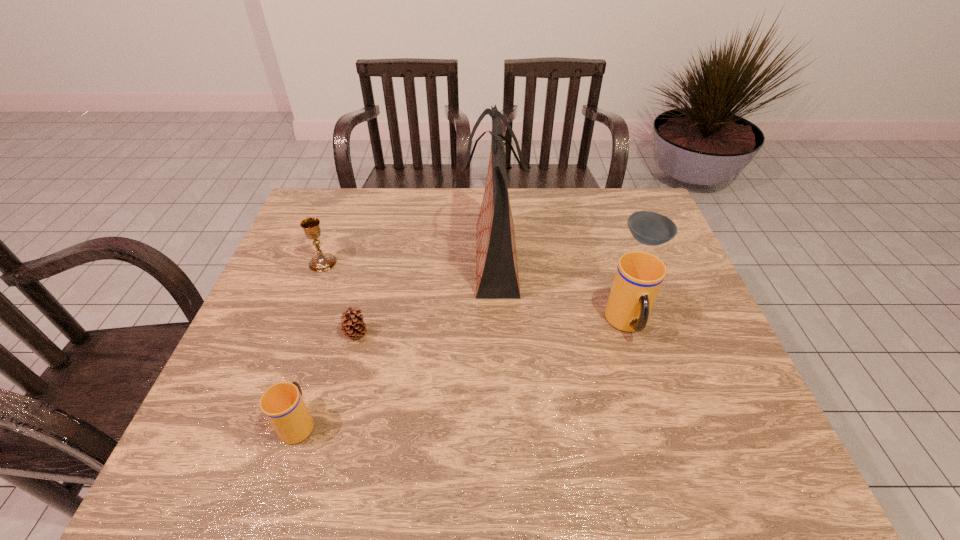
What are the coordinates of `free space at the near edge` in the screenshot? It's located at (585, 408).

The width and height of the screenshot is (960, 540). In the image, there is a desktop. Identify the location of free space at the left edge. (258, 346).

In the image, there is a desktop. Identify the location of vacant space at the far right corner. The image size is (960, 540). (607, 188).

The height and width of the screenshot is (540, 960). Find the location of `vacant space that is in between the fifth shortest object and the leftmost object`. vacant space that is in between the fifth shortest object and the leftmost object is located at coordinates (475, 293).

Find the location of a particular element. free area in between the right cup and the third tallest object is located at coordinates (475, 293).

This screenshot has height=540, width=960. Identify the location of empty location between the taller cup and the fifth object from right to left. (464, 373).

At what (x,y) coordinates should I click in order to perform the action: click on free space that is in between the bowl and the tallest object. Please return your answer as a coordinate pair (x, y). This screenshot has height=540, width=960. Looking at the image, I should click on (570, 250).

Locate an element on the screen. This screenshot has height=540, width=960. vacant space that's between the fifth object from right to left and the rightmost object is located at coordinates (473, 331).

Identify the location of empty space that is in between the shorter cup and the third object from left to right. The height and width of the screenshot is (540, 960). (327, 378).

In order to click on vacant area that lies between the shorter cup and the chalice in this screenshot , I will do `click(311, 342)`.